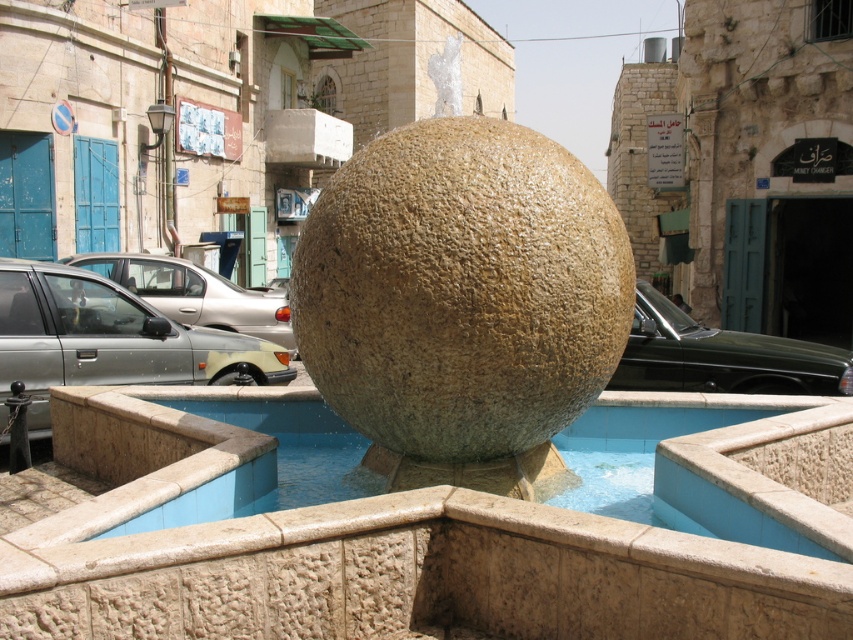
You are a pedestrian standing in front of the shiny black car at center. You want to walk to the silver metallic car at left. Which direction should you go?

The shiny black car at center is below the silver metallic car at left, so you should walk upwards to reach the silver metallic car at left.

In the scene shown: You are a pedestrian standing in front of the shiny black car at center. Which direction should you walk to reach the blue stone pool at center?

The blue stone pool at center is to the left of the shiny black car at center, so you should walk to the left to reach it.